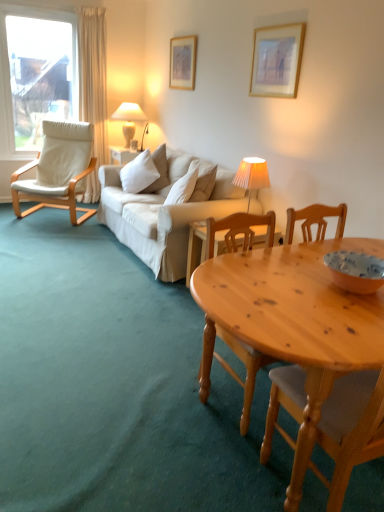
Question: Is white pleated fabric lampshade at center, arranged as the first lamp when viewed from the right, far from wooden picture frame at upper center, the 1th picture frame from the bottom?

Choices:
 (A) yes
 (B) no

Answer: (B)

Question: Is white pleated fabric lampshade at center, arranged as the first lamp when viewed from the right, oriented away from wooden picture frame at upper center, the second picture frame in the left-to-right sequence?

Choices:
 (A) no
 (B) yes

Answer: (A)

Question: Is white pleated fabric lampshade at center, which is the first lamp in front-to-back order, next to wooden picture frame at upper center, the second picture frame in the left-to-right sequence?

Choices:
 (A) no
 (B) yes

Answer: (A)

Question: From a real-world perspective, is white pleated fabric lampshade at center, the second lamp positioned from the back, under wooden picture frame at upper center, the second picture frame in the back-to-front sequence?

Choices:
 (A) yes
 (B) no

Answer: (A)

Question: Could you tell me if white pleated fabric lampshade at center, the second lamp positioned from the back, is facing wooden picture frame at upper center, the second picture frame in the left-to-right sequence?

Choices:
 (A) no
 (B) yes

Answer: (A)

Question: Is matte orange bowl at lower right taller or shorter than white pleated fabric lampshade at center, placed as the first lamp when sorted from bottom to top?

Choices:
 (A) tall
 (B) short

Answer: (B)

Question: From the image's perspective, is matte orange bowl at lower right located above or below white pleated fabric lampshade at center, which is the first lamp in front-to-back order?

Choices:
 (A) above
 (B) below

Answer: (B)

Question: Based on their sizes in the image, would you say matte orange bowl at lower right is bigger or smaller than white pleated fabric lampshade at center, which is the 2th lamp from left to right?

Choices:
 (A) small
 (B) big

Answer: (A)

Question: In the image, is matte orange bowl at lower right positioned in front of or behind white pleated fabric lampshade at center, placed as the first lamp when sorted from bottom to top?

Choices:
 (A) behind
 (B) front

Answer: (B)

Question: Is point (147, 181) positioned closer to the camera than point (276, 46)?

Choices:
 (A) closer
 (B) farther

Answer: (B)

Question: Is white soft cushion at center to the left or to the right of wooden picture frame at upper center, the second picture frame in the back-to-front sequence, in the image?

Choices:
 (A) right
 (B) left

Answer: (B)

Question: From a real-world perspective, is white soft cushion at center positioned above or below wooden picture frame at upper center, marked as the 1th picture frame in a front-to-back arrangement?

Choices:
 (A) above
 (B) below

Answer: (B)

Question: Is white soft cushion at center inside the boundaries of wooden picture frame at upper center, which ranks as the 2th picture frame in top-to-bottom order, or outside?

Choices:
 (A) outside
 (B) inside

Answer: (A)

Question: From the image's perspective, is natural wood table at lower right located above or below white pleated fabric lampshade at center, arranged as the first lamp when viewed from the right?

Choices:
 (A) above
 (B) below

Answer: (B)

Question: Which is correct: natural wood table at lower right is inside white pleated fabric lampshade at center, which is the 2th lamp from left to right, or outside of it?

Choices:
 (A) outside
 (B) inside

Answer: (A)